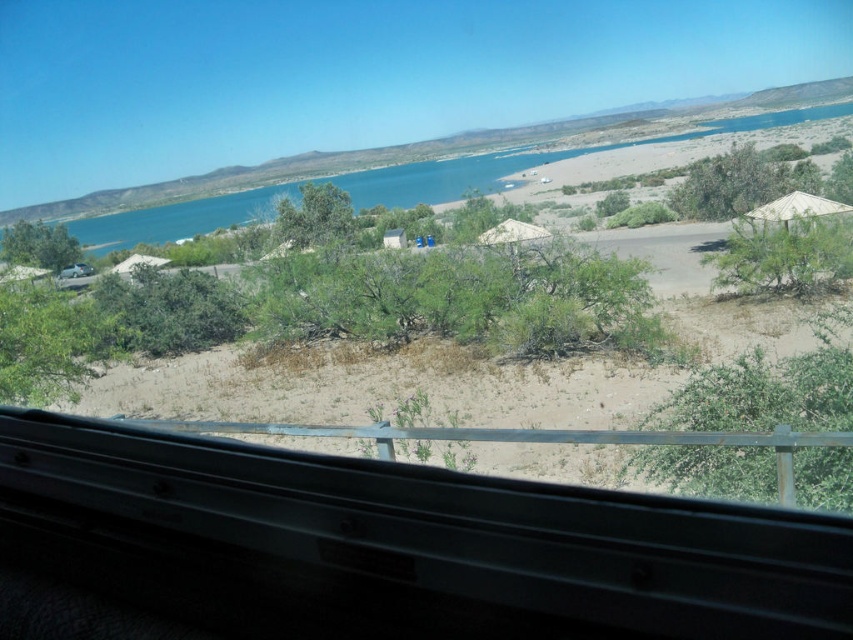
Question: Is beige fabric tent at center positioned before white matte hut at lower left?

Choices:
 (A) yes
 (B) no

Answer: (A)

Question: Can you confirm if green leafy tree at center is bigger than white matte hut at lower left?

Choices:
 (A) no
 (B) yes

Answer: (A)

Question: Is blue water at upper left behind white matte hut at lower left?

Choices:
 (A) no
 (B) yes

Answer: (B)

Question: Which object is positioned closest to the green leafy tree at left?

Choices:
 (A) green leafy tree at center
 (B) green leafy tree at right

Answer: (A)

Question: Which point is farther from the camera taking this photo?

Choices:
 (A) (74, 381)
 (B) (323, 225)

Answer: (B)

Question: Among these objects, which one is farthest from the camera?

Choices:
 (A) white matte hut at lower left
 (B) green leafy tree at left
 (C) beige fabric tent at center
 (D) blue water at upper left

Answer: (D)